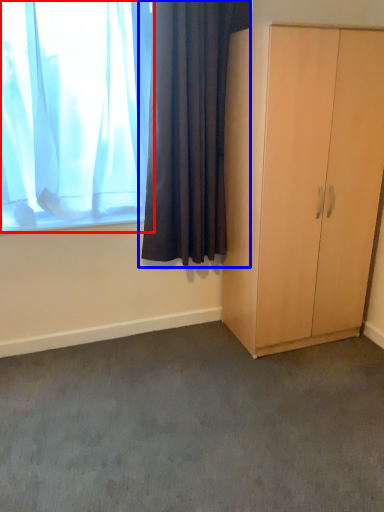
Question: Which object appears closest to the camera in this image, curtain (highlighted by a red box) or curtain (highlighted by a blue box)?

Choices:
 (A) curtain
 (B) curtain

Answer: (A)